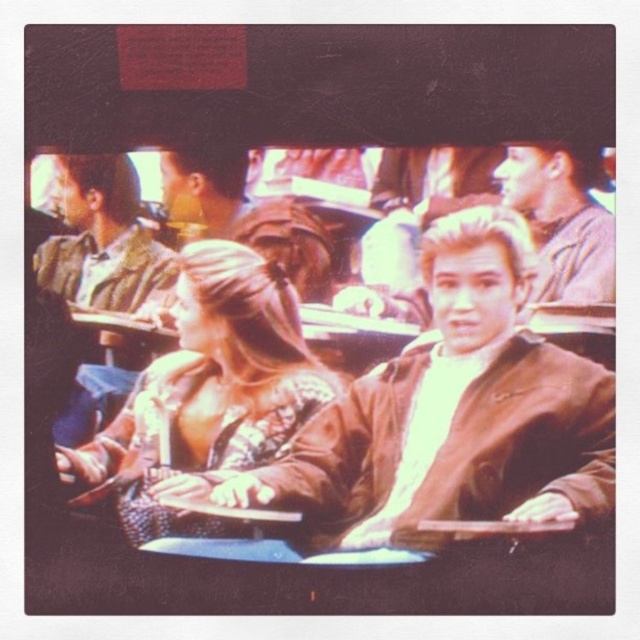
You are a tailor measuring jackets for a school event. You have two jackets in front of you, the brown leather jacket at center and the matte brown jacket at upper right. Which jacket has a greater width?

The brown leather jacket at center has a greater width than the matte brown jacket at upper right.

In the scene shown: You are a photographer trying to capture a candid shot of the leather jacket at center and the striped shirt at left. Since both are in the frame, can you tell me which one is positioned lower in the image?

The leather jacket at center is positioned lower than the striped shirt at left in the image.